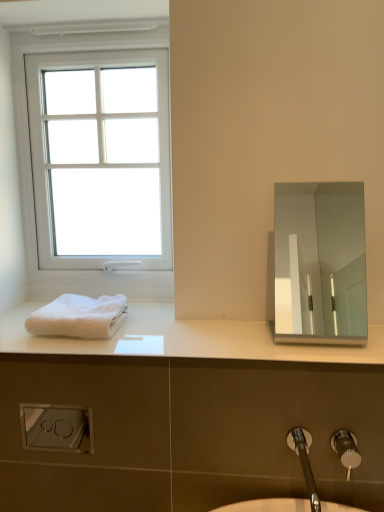
Question: Should I look upward or downward to see white plastic window at upper left?

Choices:
 (A) down
 (B) up

Answer: (B)

Question: Is white matte towel at left not within white plastic window at upper left?

Choices:
 (A) no
 (B) yes

Answer: (B)

Question: Could white plastic window at upper left be considered to be inside white matte towel at left?

Choices:
 (A) yes
 (B) no

Answer: (B)

Question: Considering the relative positions of white matte towel at left and white plastic window at upper left in the image provided, is white matte towel at left in front of white plastic window at upper left?

Choices:
 (A) no
 (B) yes

Answer: (B)

Question: From the image's perspective, would you say white matte towel at left is positioned over white plastic window at upper left?

Choices:
 (A) no
 (B) yes

Answer: (A)

Question: Is white matte towel at left to the left of white plastic window at upper left from the viewer's perspective?

Choices:
 (A) no
 (B) yes

Answer: (A)

Question: Can you confirm if white matte towel at left is thinner than white plastic window at upper left?

Choices:
 (A) yes
 (B) no

Answer: (B)

Question: Is white matte towel at left positioned with its back to polished silver mirror at upper right?

Choices:
 (A) no
 (B) yes

Answer: (A)

Question: Is white matte towel at left smaller than polished silver mirror at upper right?

Choices:
 (A) no
 (B) yes

Answer: (B)

Question: Would you say white matte towel at left is outside polished silver mirror at upper right?

Choices:
 (A) yes
 (B) no

Answer: (A)

Question: Is white matte towel at left taller than polished silver mirror at upper right?

Choices:
 (A) no
 (B) yes

Answer: (A)

Question: Is white matte towel at left positioned before polished silver mirror at upper right?

Choices:
 (A) yes
 (B) no

Answer: (A)

Question: Is white matte towel at left surrounding polished silver mirror at upper right?

Choices:
 (A) yes
 (B) no

Answer: (B)

Question: Is polished silver mirror at upper right at the left side of white matte towel at left?

Choices:
 (A) no
 (B) yes

Answer: (A)